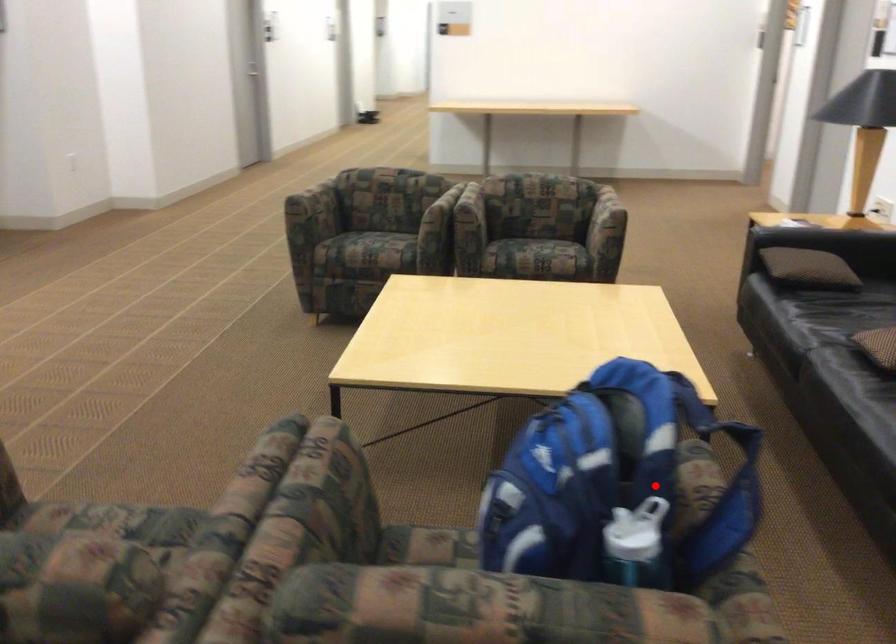
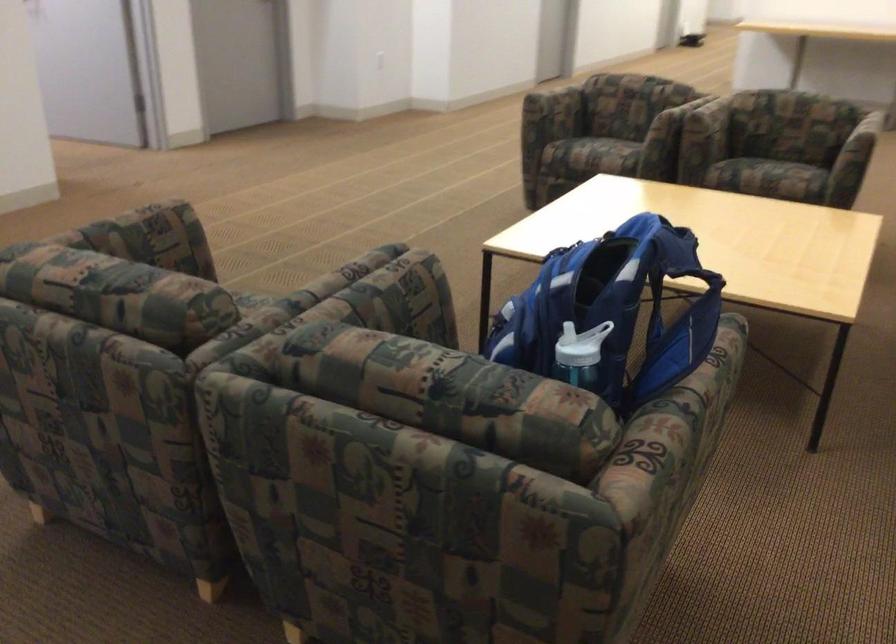
In the second image, find the point that corresponds to the highlighted location in the first image.

(613, 310)